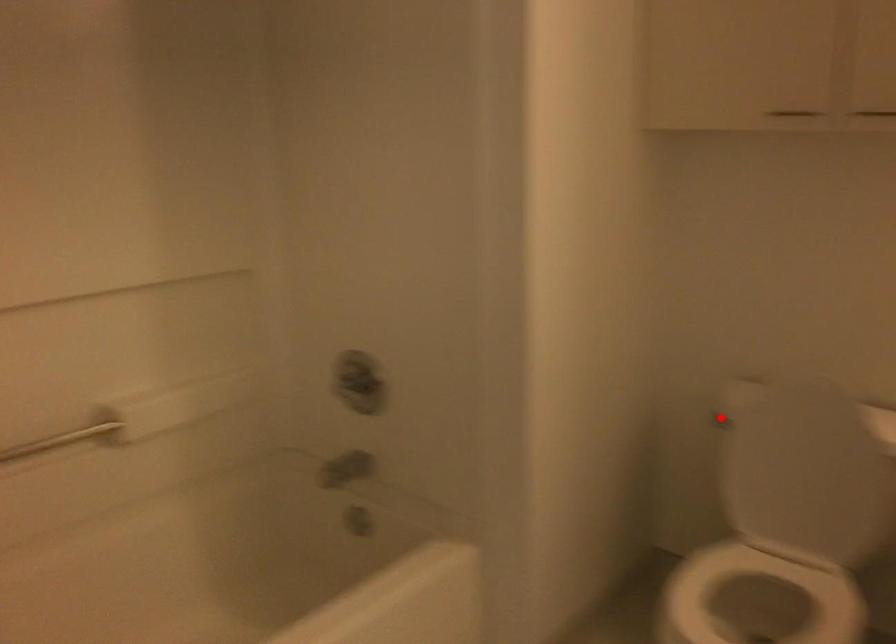
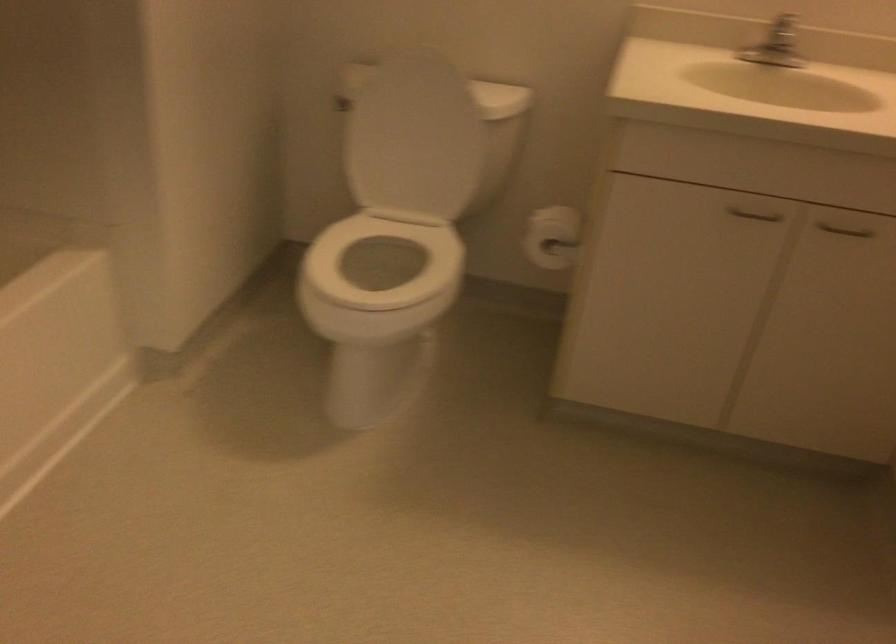
Question: I am providing you with two images of the same scene from different viewpoints. A red point is marked on the first image. Can you still see the location of the red point in image 2?

Choices:
 (A) Yes
 (B) No

Answer: (A)